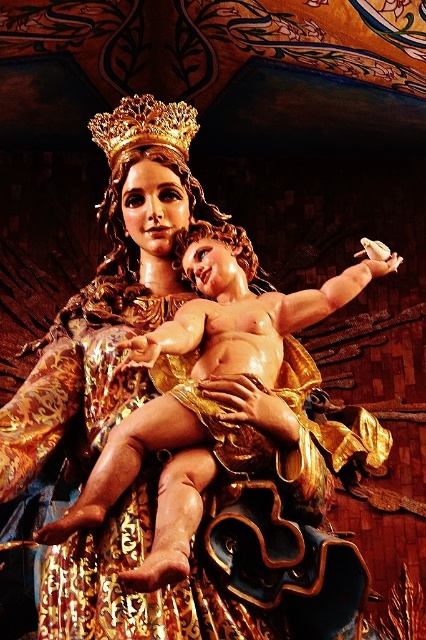
Is point (54, 520) farther from viewer compared to point (146, 131)?

No.

Does smooth gold baby at center appear on the right side of gold metallic crown at upper center?

Yes, smooth gold baby at center is to the right of gold metallic crown at upper center.

Does point (126, 573) come in front of point (141, 134)?

Yes, it is in front of point (141, 134).

Find the location of `smooth gold baby at center`. smooth gold baby at center is located at coordinates (198, 392).